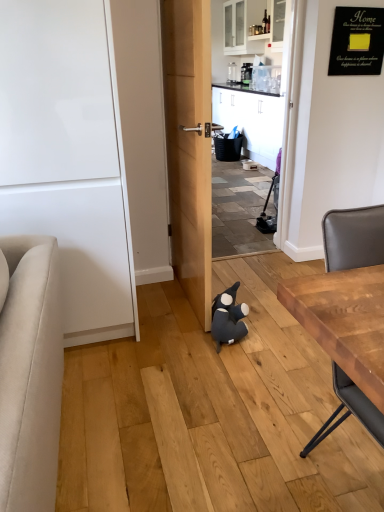
Question: Can you confirm if white glossy door at left is shorter than dark blue plush toy at center?

Choices:
 (A) no
 (B) yes

Answer: (A)

Question: Can you confirm if white glossy door at left is positioned to the right of dark blue plush toy at center?

Choices:
 (A) no
 (B) yes

Answer: (A)

Question: Is white glossy door at left positioned in front of dark blue plush toy at center?

Choices:
 (A) no
 (B) yes

Answer: (B)

Question: Is white glossy door at left bigger than dark blue plush toy at center?

Choices:
 (A) yes
 (B) no

Answer: (A)

Question: Is white glossy door at left positioned far away from dark blue plush toy at center?

Choices:
 (A) no
 (B) yes

Answer: (A)

Question: Does white glossy door at left appear on the left side of dark blue plush toy at center?

Choices:
 (A) no
 (B) yes

Answer: (B)

Question: From a real-world perspective, is white glossy door at left located beneath wooden table at right?

Choices:
 (A) no
 (B) yes

Answer: (A)

Question: Considering the relative sizes of white glossy door at left and wooden table at right in the image provided, is white glossy door at left shorter than wooden table at right?

Choices:
 (A) yes
 (B) no

Answer: (B)

Question: From the image's perspective, is white glossy door at left located beneath wooden table at right?

Choices:
 (A) no
 (B) yes

Answer: (A)

Question: Does white glossy door at left have a greater height compared to wooden table at right?

Choices:
 (A) no
 (B) yes

Answer: (B)

Question: Does white glossy door at left turn towards wooden table at right?

Choices:
 (A) no
 (B) yes

Answer: (A)

Question: Does white glossy door at left lie in front of wooden table at right?

Choices:
 (A) no
 (B) yes

Answer: (A)

Question: Does dark blue plush toy at center have a lesser height compared to wooden table at right?

Choices:
 (A) yes
 (B) no

Answer: (A)